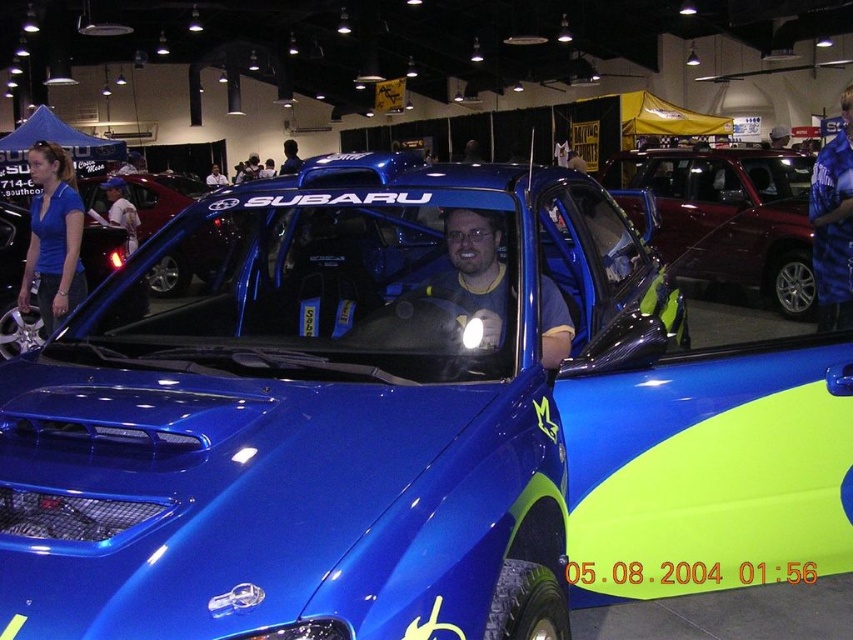
Question: Which point appears farthest from the camera in this image?

Choices:
 (A) (228, 221)
 (B) (836, 237)
 (C) (41, 307)
 (D) (285, 156)

Answer: (D)

Question: Where is matte blue shirt at left located in relation to matte blue helmet at center in the image?

Choices:
 (A) below
 (B) above

Answer: (A)

Question: Is matte blue shirt at left further to camera compared to matte blue car at center?

Choices:
 (A) yes
 (B) no

Answer: (A)

Question: Is shiny metallic suv at center positioned in front of matte blue shirt at center?

Choices:
 (A) no
 (B) yes

Answer: (B)

Question: Which point is closer to the camera taking this photo?

Choices:
 (A) (776, 259)
 (B) (103, 189)

Answer: (A)

Question: Estimate the real-world distances between objects in this image. Which object is closer to the matte blue helmet at center?

Choices:
 (A) blue jersey at center
 (B) matte blue shirt at center

Answer: (B)